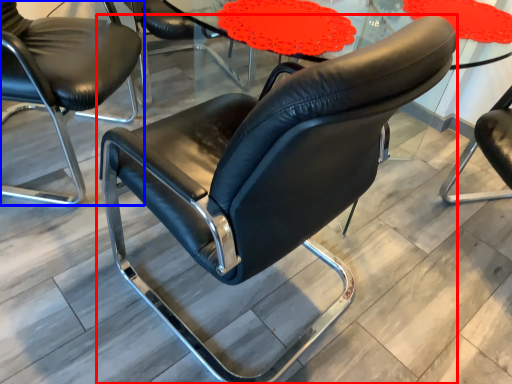
Question: Which object appears farthest to the camera in this image, chair (highlighted by a red box) or chair (highlighted by a blue box)?

Choices:
 (A) chair
 (B) chair

Answer: (B)